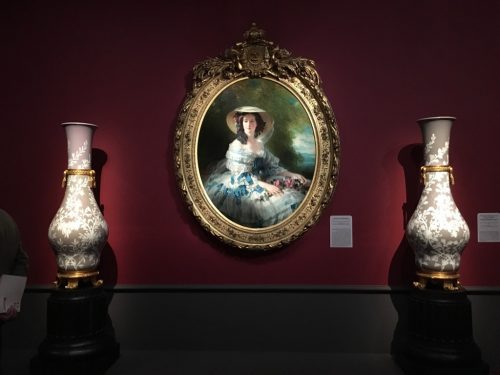
At what (x,y) coordinates should I click in order to perform the action: click on vase. Please return your answer as a coordinate pair (x, y). The image size is (500, 375). Looking at the image, I should click on (436, 211), (73, 230).